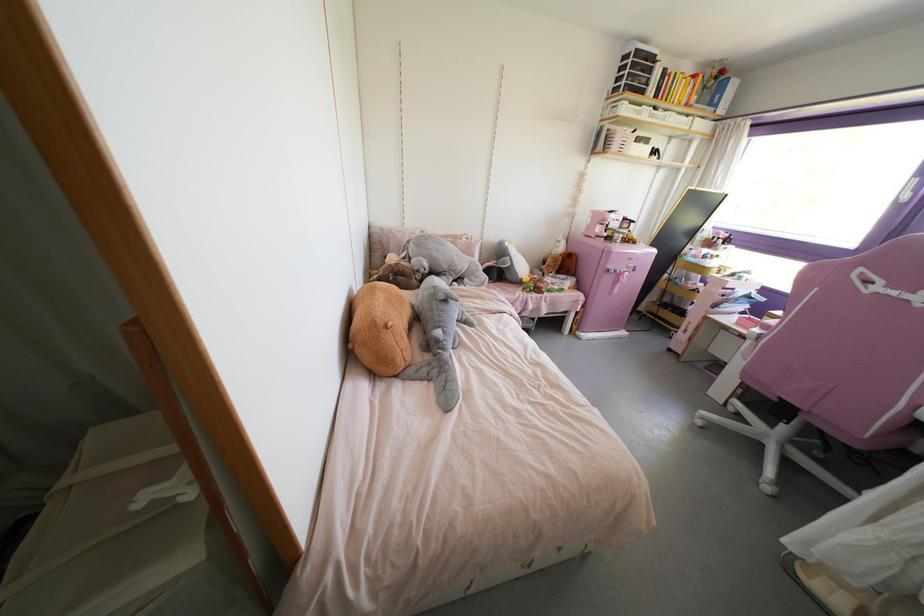
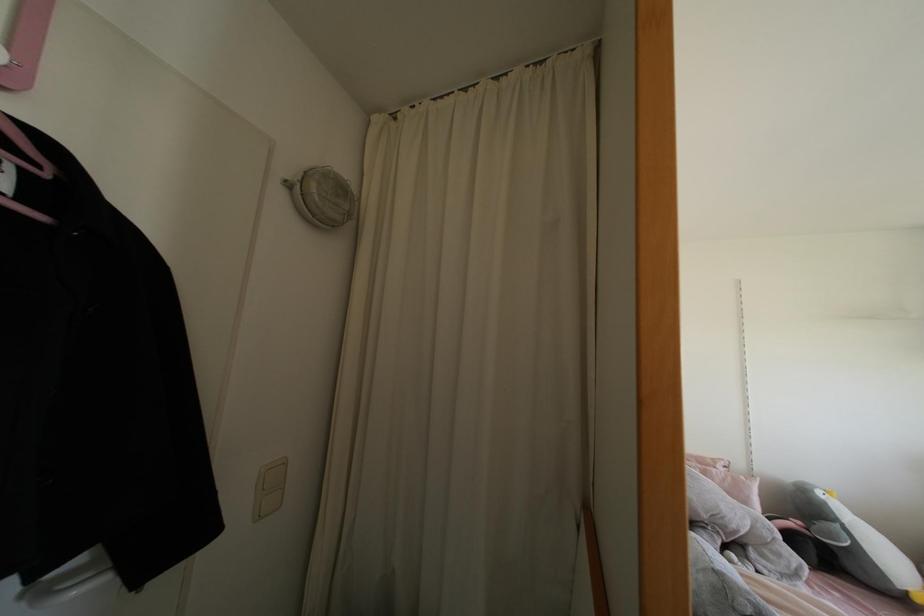
Find the pixel in the second image that matches point (505, 243) in the first image.

(819, 493)